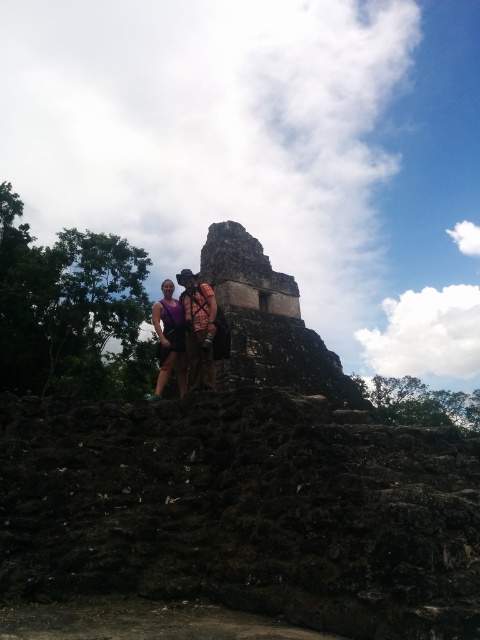
Question: Is rustic stone structure at center to the right of matte purple tank top at center from the viewer's perspective?

Choices:
 (A) no
 (B) yes

Answer: (B)

Question: Which object is the farthest from the matte purple shirt at center?

Choices:
 (A) rustic stone structure at center
 (B) matte purple tank top at center

Answer: (A)

Question: Can you confirm if rustic stone structure at center is positioned to the left of matte purple tank top at center?

Choices:
 (A) yes
 (B) no

Answer: (B)

Question: Among these objects, which one is farthest from the camera?

Choices:
 (A) matte purple shirt at center
 (B) matte purple tank top at center

Answer: (B)

Question: Which object is the farthest from the matte purple shirt at center?

Choices:
 (A) matte purple tank top at center
 (B) rustic stone structure at center

Answer: (B)

Question: Is rustic stone structure at center above matte purple shirt at center?

Choices:
 (A) yes
 (B) no

Answer: (A)